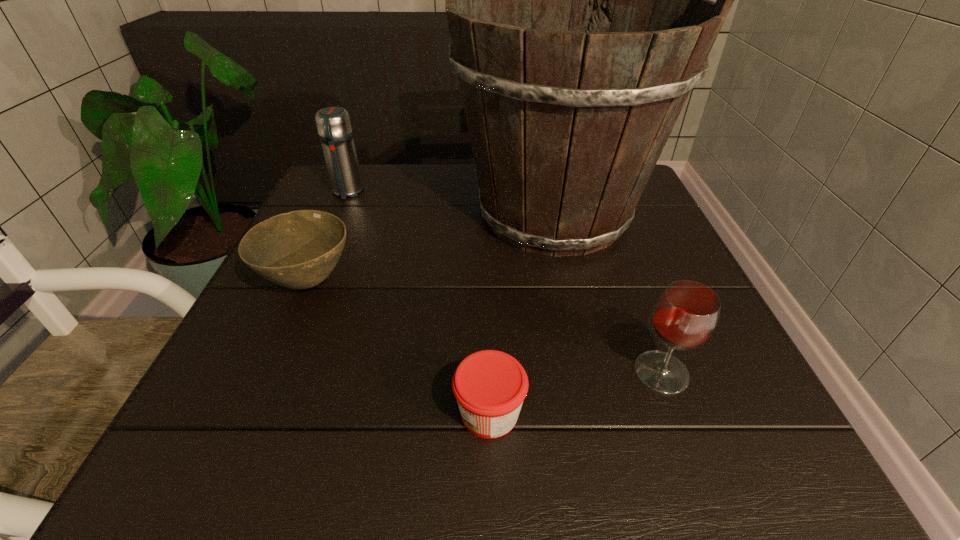
Image resolution: width=960 pixels, height=540 pixels. What are the coordinates of `free space that is in between the jam and the bucket` in the screenshot? It's located at (521, 313).

You are a GUI agent. You are given a task and a screenshot of the screen. Output one action in this format:
    pyautogui.click(x=<x>, y=<y>)
    Task: Click on the free space between the jam and the wineglass
    This screenshot has height=540, width=960.
    Given the screenshot: What is the action you would take?
    pyautogui.click(x=575, y=393)

Locate an element on the screen. The height and width of the screenshot is (540, 960). free space between the fourth tallest object and the bucket is located at coordinates (431, 248).

At what (x,y) coordinates should I click in order to perform the action: click on free space between the second tallest object and the shortest object. Please return your answer as a coordinate pair (x, y). This screenshot has width=960, height=540. Looking at the image, I should click on (419, 302).

What are the coordinates of `object that is the second closest to the jam` in the screenshot? It's located at (567, 118).

Locate an element on the screen. The width and height of the screenshot is (960, 540). the closest object to the jam is located at coordinates (685, 316).

Identify the location of free location that satisfies the following two spatial constraints: 1. on the front side of the bucket; 2. on the label side of the jam. This screenshot has height=540, width=960. coord(599,413).

Identify the location of free space that satisfies the following two spatial constraints: 1. on the front side of the third shortest object; 2. on the label side of the shortest object. (677, 413).

Locate an element on the screen. free spot that satisfies the following two spatial constraints: 1. on the front side of the wineglass; 2. on the label side of the jam is located at coordinates (677, 413).

Identify the location of vacant area that satisfies the following two spatial constraints: 1. with a handle on the side of the fourth shortest object; 2. on the right side of the fourth tallest object. This screenshot has height=540, width=960. (307, 282).